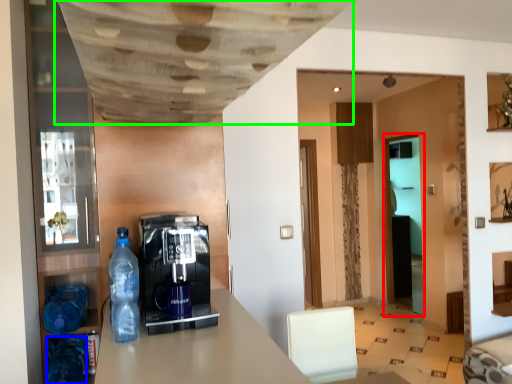
Question: Which is nearer to the glass door (highlighted by a red box)? bottle (highlighted by a blue box) or exhaust hood (highlighted by a green box).

Choices:
 (A) bottle
 (B) exhaust hood

Answer: (B)